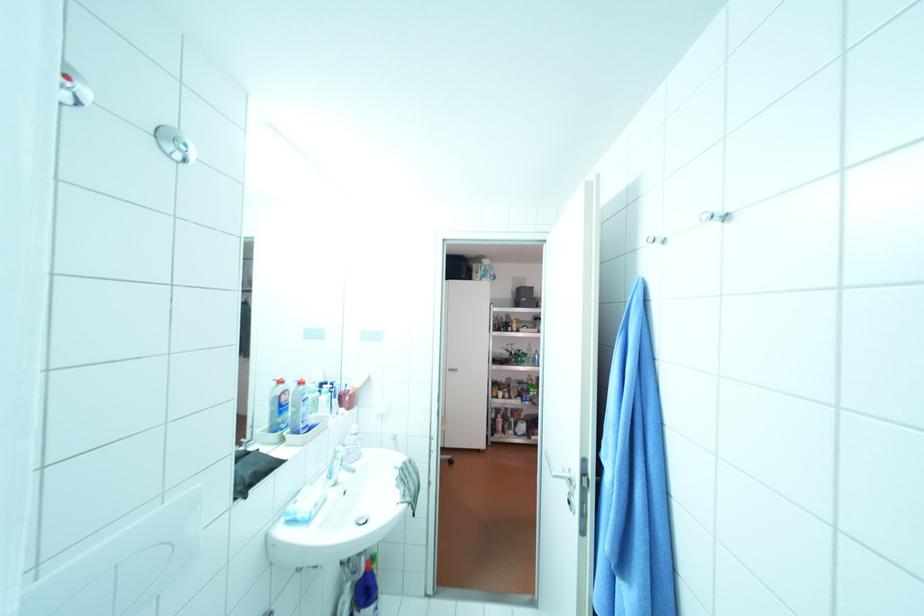
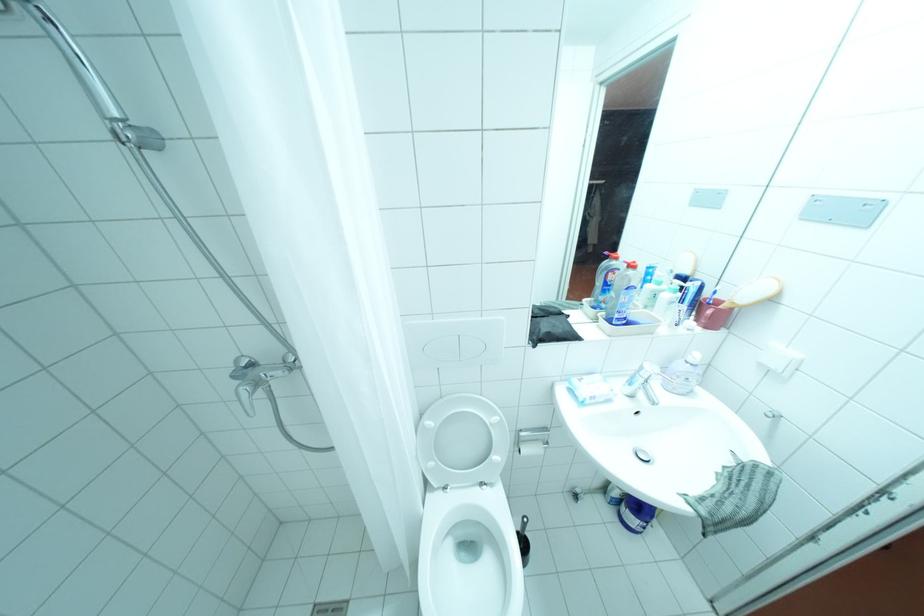
Where in the second image is the point corresponding to the point at 341,480 from the first image?

(638, 390)